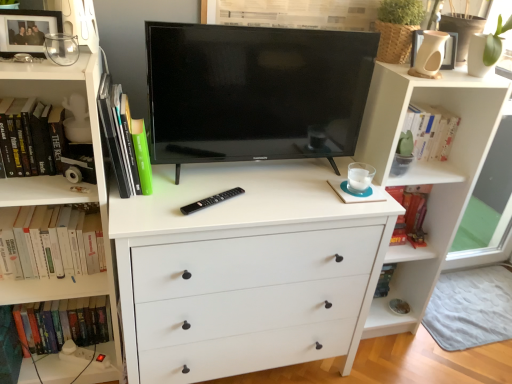
Find the location of a particular element. vacant space in black glossy tv at center (from a real-world perspective) is located at coordinates (234, 173).